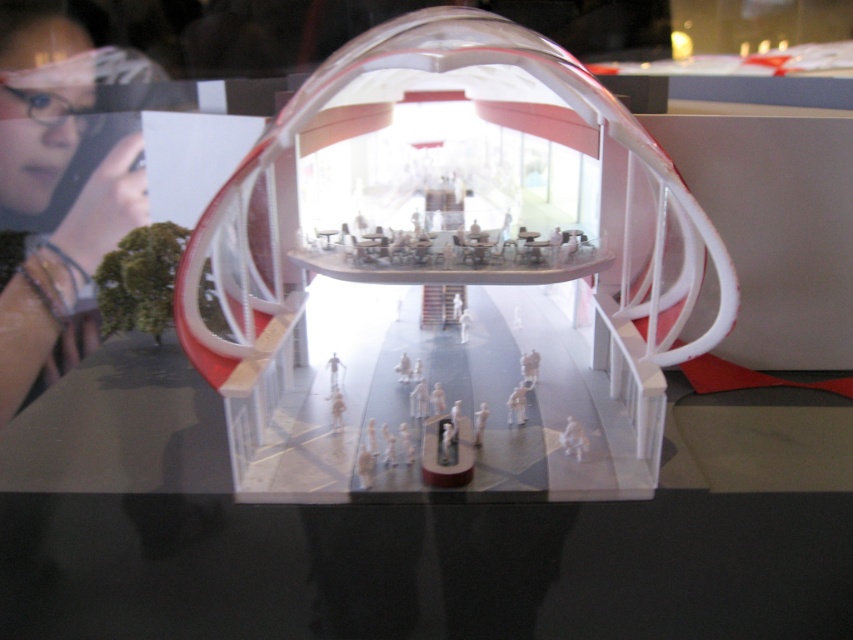
Question: Can you confirm if transparent plastic glass box at center is bigger than matte black phone at upper left?

Choices:
 (A) no
 (B) yes

Answer: (B)

Question: Which point is closer to the camera taking this photo?

Choices:
 (A) (315, 276)
 (B) (65, 177)

Answer: (A)

Question: Is transparent plastic glass box at center bigger than matte black phone at upper left?

Choices:
 (A) yes
 (B) no

Answer: (A)

Question: Does transparent plastic glass box at center have a larger size compared to matte black phone at upper left?

Choices:
 (A) no
 (B) yes

Answer: (B)

Question: Which object is farther from the camera taking this photo?

Choices:
 (A) matte black phone at upper left
 (B) transparent plastic glass box at center

Answer: (A)